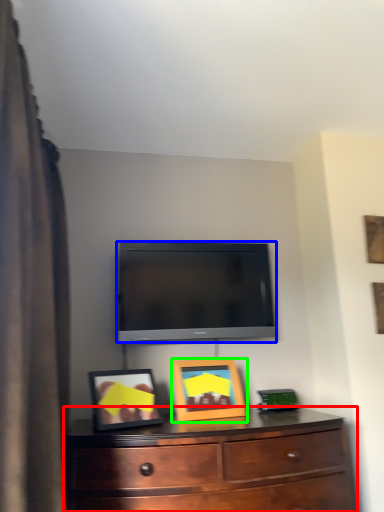
Question: Which object is the farthest from chest of drawers (highlighted by a red box)? Choose among these: television (highlighted by a blue box) or picture frame (highlighted by a green box).

Choices:
 (A) television
 (B) picture frame

Answer: (A)